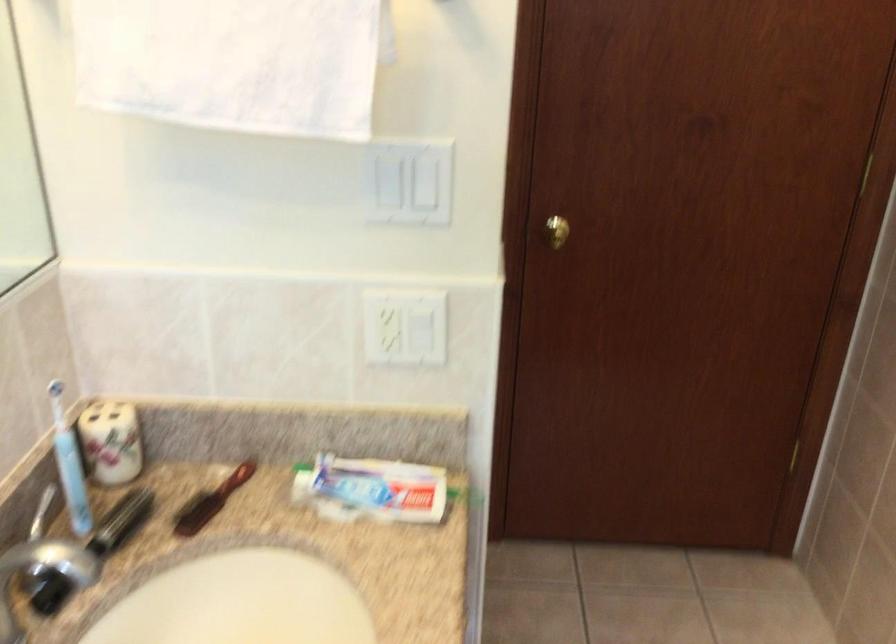
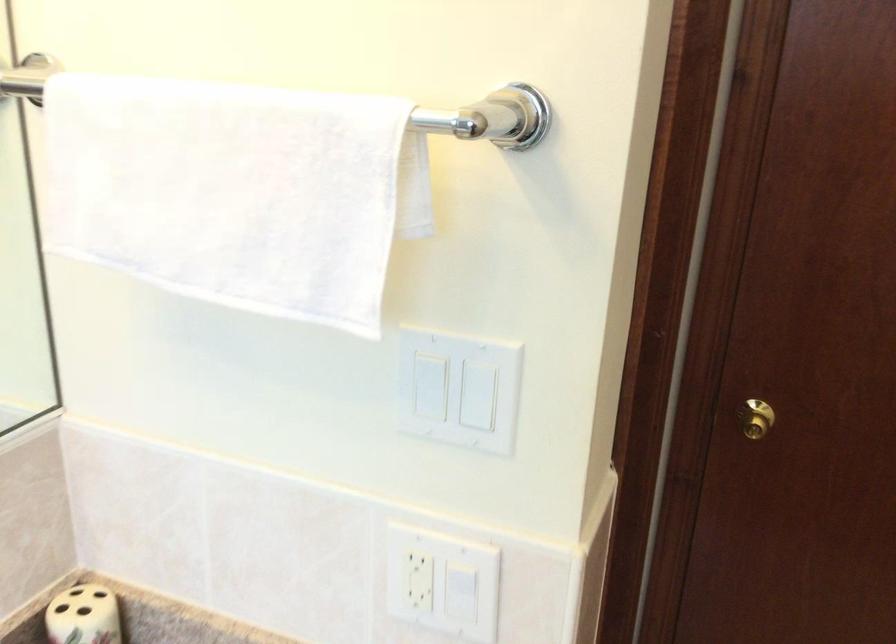
Locate, in the second image, the point that corresponds to pixel 392 327 in the first image.

(429, 581)